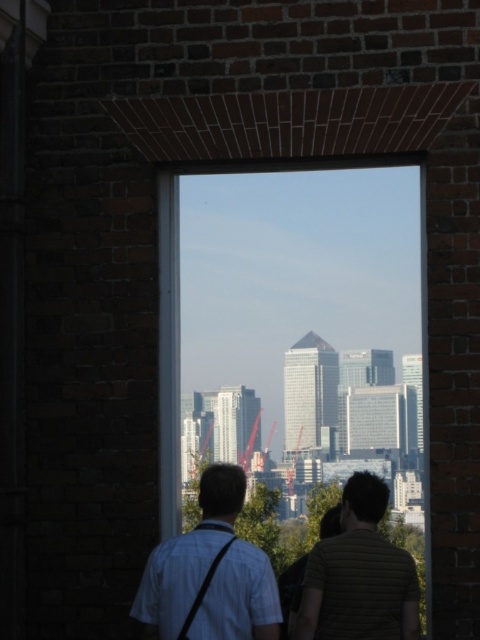
Question: Can you confirm if transparent glass window at center is positioned above reddish metallic crane at center?

Choices:
 (A) no
 (B) yes

Answer: (B)

Question: Estimate the real-world distances between objects in this image. Which object is farther from the transparent glass window at center?

Choices:
 (A) striped cotton shirt at center
 (B) light blue shirt at center
 (C) reddish metallic crane at center

Answer: (C)

Question: Does transparent glass window at center have a smaller size compared to metallic red crane at center?

Choices:
 (A) no
 (B) yes

Answer: (A)

Question: Based on their relative distances, which object is nearer to the metallic red crane at center?

Choices:
 (A) transparent glass window at center
 (B) light blue shirt at center
 (C) reddish metallic crane at center
 (D) striped cotton shirt at center

Answer: (C)

Question: Which object is the closest to the light blue shirt at center?

Choices:
 (A) striped cotton shirt at center
 (B) reddish metallic crane at center
 (C) metallic red crane at center

Answer: (A)

Question: Does metallic red crane at center have a greater width compared to reddish metallic crane at center?

Choices:
 (A) yes
 (B) no

Answer: (A)